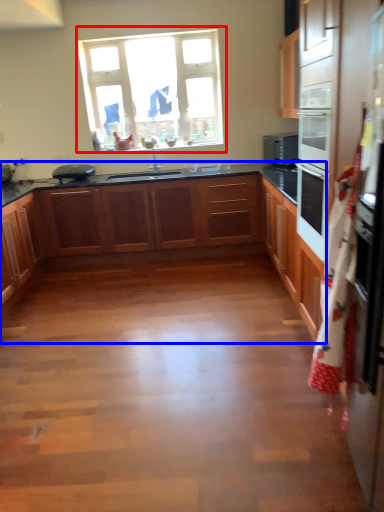
Question: Which point is closer to the camera, window (highlighted by a red box) or cabinetry (highlighted by a blue box)?

Choices:
 (A) window
 (B) cabinetry

Answer: (B)